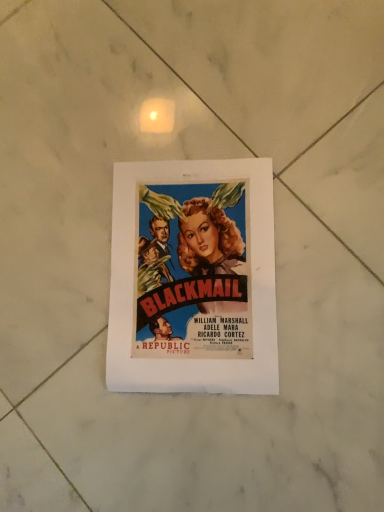
At what (x,y) coordinates should I click in order to perform the action: click on vacant area to the right of matte paper poster at center. Please return your answer as a coordinate pair (x, y). Looking at the image, I should click on (316, 168).